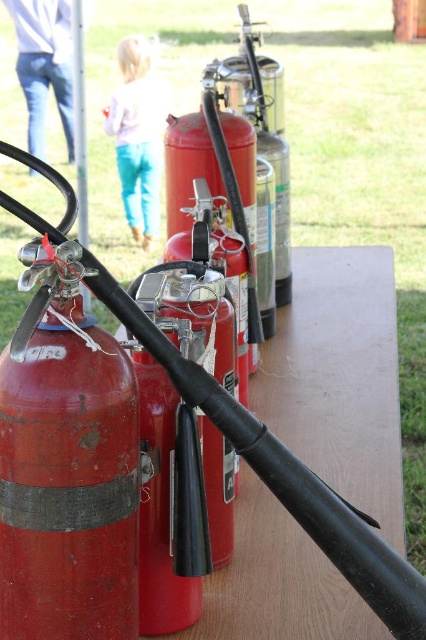
Question: Observing the image, what is the correct spatial positioning of matte red fire extinguisher at left in reference to light blue jeans at upper center?

Choices:
 (A) below
 (B) above

Answer: (A)

Question: Does matte red fire extinguisher at left have a smaller size compared to light blue jeans at upper center?

Choices:
 (A) yes
 (B) no

Answer: (A)

Question: Which object is farther from the camera taking this photo?

Choices:
 (A) light blue jeans at upper center
 (B) matte red fire extinguisher at left

Answer: (A)

Question: Which point is closer to the camera?

Choices:
 (A) (46, 259)
 (B) (126, 182)

Answer: (A)

Question: Does matte red fire extinguisher at left have a larger size compared to light blue jeans at upper center?

Choices:
 (A) yes
 (B) no

Answer: (B)